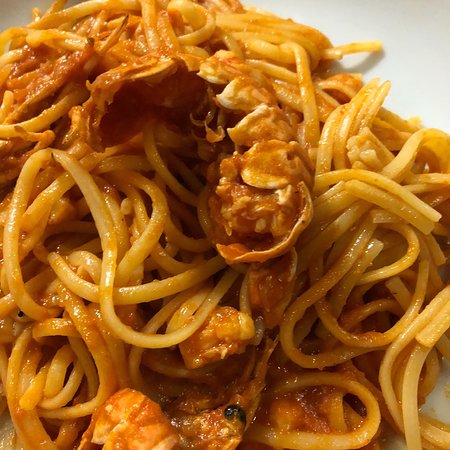
You are a GUI agent. You are given a task and a screenshot of the screen. Output one action in this format:
    pyautogui.click(x=<x>, y=<y>)
    Task: Click on the table
    The height and width of the screenshot is (450, 450).
    Given the screenshot: What is the action you would take?
    pyautogui.click(x=395, y=35)